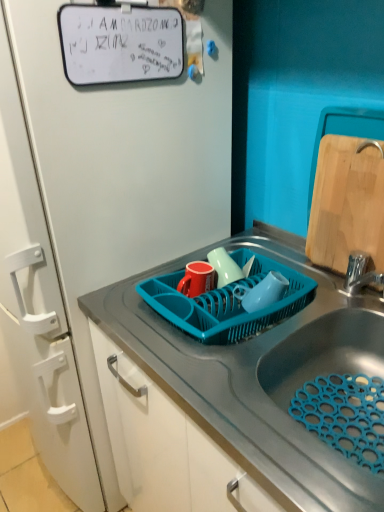
Question: From the image's perspective, is wooden cutting board at right over metallic sink at center?

Choices:
 (A) yes
 (B) no

Answer: (A)

Question: Can you confirm if wooden cutting board at right is thinner than metallic sink at center?

Choices:
 (A) yes
 (B) no

Answer: (A)

Question: Can you confirm if wooden cutting board at right is smaller than metallic sink at center?

Choices:
 (A) no
 (B) yes

Answer: (B)

Question: Is metallic sink at center surrounded by wooden cutting board at right?

Choices:
 (A) no
 (B) yes

Answer: (A)

Question: Is wooden cutting board at right positioned with its back to metallic sink at center?

Choices:
 (A) yes
 (B) no

Answer: (B)

Question: From their relative heights in the image, would you say metallic sink at center is taller or shorter than teal plastic dish rack at center?

Choices:
 (A) short
 (B) tall

Answer: (B)

Question: From a real-world perspective, is metallic sink at center positioned above or below teal plastic dish rack at center?

Choices:
 (A) below
 (B) above

Answer: (A)

Question: Looking at their shapes, would you say metallic sink at center is wider or thinner than teal plastic dish rack at center?

Choices:
 (A) wide
 (B) thin

Answer: (A)

Question: Considering the positions of point (297, 311) and point (279, 314), is point (297, 311) closer or farther from the camera than point (279, 314)?

Choices:
 (A) farther
 (B) closer

Answer: (B)

Question: From the image's perspective, is metallic sink at center located above or below wooden cutting board at right?

Choices:
 (A) below
 (B) above

Answer: (A)

Question: Considering the relative positions of metallic sink at center and wooden cutting board at right in the image provided, is metallic sink at center to the left or to the right of wooden cutting board at right?

Choices:
 (A) right
 (B) left

Answer: (B)

Question: Is metallic sink at center bigger or smaller than wooden cutting board at right?

Choices:
 (A) small
 (B) big

Answer: (B)

Question: Is point (314, 306) positioned closer to the camera than point (382, 227)?

Choices:
 (A) farther
 (B) closer

Answer: (A)

Question: Is wooden cutting board at right wider or thinner than metallic sink at center?

Choices:
 (A) wide
 (B) thin

Answer: (B)

Question: Looking at the image, does wooden cutting board at right seem bigger or smaller compared to metallic sink at center?

Choices:
 (A) small
 (B) big

Answer: (A)